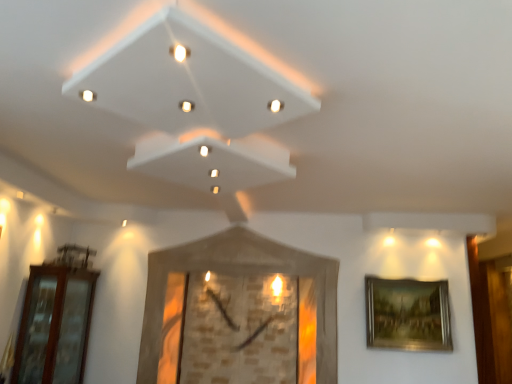
What are the coordinates of `brown glass door at left` in the screenshot? It's located at (54, 325).

Locate an element on the screen. The image size is (512, 384). wooden clock at center, the first picture frame in the left-to-right sequence is located at coordinates (237, 272).

Visually, is wooden clock at center, the 2th picture frame positioned from the right, positioned to the left or to the right of gold metallic picture frame at right, placed as the 2th picture frame when sorted from left to right?

From the image, it's evident that wooden clock at center, the 2th picture frame positioned from the right, is to the left of gold metallic picture frame at right, placed as the 2th picture frame when sorted from left to right.

In terms of size, does wooden clock at center, the first picture frame in the left-to-right sequence, appear bigger or smaller than gold metallic picture frame at right, the first picture frame viewed from the right?

In the image, wooden clock at center, the first picture frame in the left-to-right sequence, appears to be larger than gold metallic picture frame at right, the first picture frame viewed from the right.

Between wooden clock at center, the first picture frame in the left-to-right sequence, and gold metallic picture frame at right, the first picture frame viewed from the right, which one has larger width?

wooden clock at center, the first picture frame in the left-to-right sequence, is wider.

From the picture: Does wooden clock at center, the 2th picture frame positioned from the right, have a greater height compared to brown glass door at left?

Correct, wooden clock at center, the 2th picture frame positioned from the right, is much taller as brown glass door at left.

From a real-world perspective, is wooden clock at center, the first picture frame in the left-to-right sequence, beneath brown glass door at left?

No, from a real-world perspective, wooden clock at center, the first picture frame in the left-to-right sequence, is not under brown glass door at left.

In the image, is wooden clock at center, the first picture frame in the left-to-right sequence, positioned in front of or behind brown glass door at left?

Visually, wooden clock at center, the first picture frame in the left-to-right sequence, is located behind brown glass door at left.

Can you tell me how much brown glass door at left and gold metallic picture frame at right, the first picture frame viewed from the right, differ in facing direction?

90.3 degrees.

Relative to gold metallic picture frame at right, the first picture frame viewed from the right, is brown glass door at left in front or behind?

Visually, brown glass door at left is located in front of gold metallic picture frame at right, the first picture frame viewed from the right.

At what (x,y) coordinates should I click in order to perform the action: click on picture frame that is the 2nd one when counting rightward from the brown glass door at left. Please return your answer as a coordinate pair (x, y). Image resolution: width=512 pixels, height=384 pixels. Looking at the image, I should click on pyautogui.click(x=408, y=314).

Is brown glass door at left shorter than gold metallic picture frame at right, placed as the 2th picture frame when sorted from left to right?

Incorrect, the height of brown glass door at left does not fall short of that of gold metallic picture frame at right, placed as the 2th picture frame when sorted from left to right.

Can you confirm if gold metallic picture frame at right, the first picture frame viewed from the right, is bigger than brown glass door at left?

No, gold metallic picture frame at right, the first picture frame viewed from the right, is not bigger than brown glass door at left.

Does point (439, 315) come in front of point (58, 265)?

No, (439, 315) is behind (58, 265).

From the image's perspective, which is above, gold metallic picture frame at right, placed as the 2th picture frame when sorted from left to right, or brown glass door at left?

gold metallic picture frame at right, placed as the 2th picture frame when sorted from left to right, appears higher in the image.

Choose the correct answer: Is gold metallic picture frame at right, the first picture frame viewed from the right, inside brown glass door at left or outside it?

gold metallic picture frame at right, the first picture frame viewed from the right, is outside brown glass door at left.

From the picture: Is gold metallic picture frame at right, placed as the 2th picture frame when sorted from left to right, bigger than wooden clock at center, the 2th picture frame positioned from the right?

No.

Is point (401, 337) positioned before point (214, 235)?

Yes.

Which is correct: gold metallic picture frame at right, placed as the 2th picture frame when sorted from left to right, is inside wooden clock at center, the first picture frame in the left-to-right sequence, or outside of it?

gold metallic picture frame at right, placed as the 2th picture frame when sorted from left to right, is not inside wooden clock at center, the first picture frame in the left-to-right sequence, it's outside.

Does gold metallic picture frame at right, placed as the 2th picture frame when sorted from left to right, touch wooden clock at center, the 2th picture frame positioned from the right?

There is a gap between gold metallic picture frame at right, placed as the 2th picture frame when sorted from left to right, and wooden clock at center, the 2th picture frame positioned from the right.

In terms of height, does brown glass door at left look taller or shorter compared to wooden clock at center, the 2th picture frame positioned from the right?

→ brown glass door at left is shorter than wooden clock at center, the 2th picture frame positioned from the right.

Is brown glass door at left not within wooden clock at center, the 2th picture frame positioned from the right?

That's correct, brown glass door at left is outside of wooden clock at center, the 2th picture frame positioned from the right.

Find the location of `the 1st picture frame behind the brown glass door at left, counting from the anchor's position`. the 1st picture frame behind the brown glass door at left, counting from the anchor's position is located at coordinates pos(237,272).

Can you confirm if brown glass door at left is bigger than wooden clock at center, the 2th picture frame positioned from the right?

No, brown glass door at left is not bigger than wooden clock at center, the 2th picture frame positioned from the right.

At what (x,y) coordinates should I click in order to perform the action: click on picture frame behind the wooden clock at center, the first picture frame in the left-to-right sequence. Please return your answer as a coordinate pair (x, y). The height and width of the screenshot is (384, 512). Looking at the image, I should click on (408, 314).

Where is `glass door that appears below the wooden clock at center, the 2th picture frame positioned from the right (from the image's perspective)`? The width and height of the screenshot is (512, 384). glass door that appears below the wooden clock at center, the 2th picture frame positioned from the right (from the image's perspective) is located at coordinates (54, 325).

Based on their spatial positions, is wooden clock at center, the first picture frame in the left-to-right sequence, or brown glass door at left further from gold metallic picture frame at right, placed as the 2th picture frame when sorted from left to right?

The object further to gold metallic picture frame at right, placed as the 2th picture frame when sorted from left to right, is brown glass door at left.

Based on their spatial positions, is wooden clock at center, the 2th picture frame positioned from the right, or gold metallic picture frame at right, placed as the 2th picture frame when sorted from left to right, closer to brown glass door at left?

wooden clock at center, the 2th picture frame positioned from the right, is positioned closer to the anchor brown glass door at left.

Which object lies further to the anchor point wooden clock at center, the first picture frame in the left-to-right sequence, brown glass door at left or gold metallic picture frame at right, placed as the 2th picture frame when sorted from left to right?

Among the two, brown glass door at left is located further to wooden clock at center, the first picture frame in the left-to-right sequence.

From the image, which object appears to be farther from brown glass door at left, gold metallic picture frame at right, placed as the 2th picture frame when sorted from left to right, or wooden clock at center, the 2th picture frame positioned from the right?

gold metallic picture frame at right, placed as the 2th picture frame when sorted from left to right.

Considering their positions, is gold metallic picture frame at right, the first picture frame viewed from the right, positioned further to wooden clock at center, the first picture frame in the left-to-right sequence, than brown glass door at left?

Based on the image, brown glass door at left appears to be further to wooden clock at center, the first picture frame in the left-to-right sequence.

Based on their spatial positions, is brown glass door at left or wooden clock at center, the first picture frame in the left-to-right sequence, closer to gold metallic picture frame at right, placed as the 2th picture frame when sorted from left to right?

wooden clock at center, the first picture frame in the left-to-right sequence.

Identify the location of picture frame situated between brown glass door at left and gold metallic picture frame at right, placed as the 2th picture frame when sorted from left to right, from left to right. (237, 272).